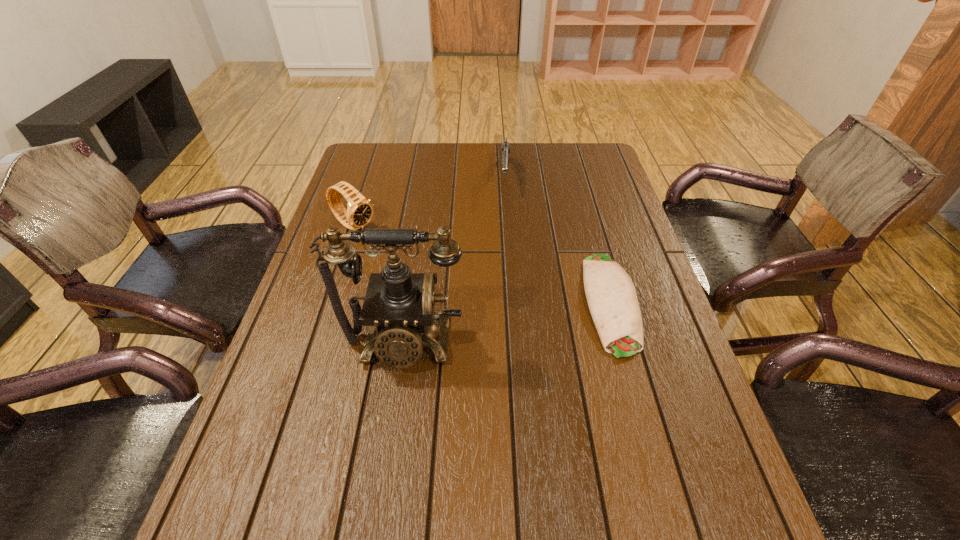
This screenshot has height=540, width=960. I want to click on free space located 0.220m on the face of the watch, so click(x=424, y=268).

You are a GUI agent. You are given a task and a screenshot of the screen. Output one action in this format:
    pyautogui.click(x=<x>, y=<y>)
    Task: Click on the vacant space located on the face of the watch
    The width and height of the screenshot is (960, 540).
    Given the screenshot: What is the action you would take?
    pyautogui.click(x=419, y=265)

Locate an element on the screen. The image size is (960, 540). vacant space located 0.230m aiming along the barrel of the second object from right to left is located at coordinates (505, 244).

Find the location of a particular element. The height and width of the screenshot is (540, 960). free region located aiming along the barrel of the second object from right to left is located at coordinates (503, 278).

Find the location of a particular element. The height and width of the screenshot is (540, 960). vacant space located 0.150m aiming along the barrel of the second object from right to left is located at coordinates (505, 226).

At what (x,y) coordinates should I click in order to perform the action: click on object present at the far edge. Please return your answer as a coordinate pair (x, y). The width and height of the screenshot is (960, 540). Looking at the image, I should click on (505, 151).

Where is `telephone located at the left edge`? Image resolution: width=960 pixels, height=540 pixels. telephone located at the left edge is located at coordinates (398, 306).

Find the location of a particular element. watch present at the left edge is located at coordinates [x=359, y=212].

The image size is (960, 540). I want to click on object at the right edge, so click(612, 299).

At what (x,y) coordinates should I click in order to perform the action: click on vacant space at the far edge of the desktop. Please return your answer as a coordinate pair (x, y). The height and width of the screenshot is (540, 960). Looking at the image, I should click on (406, 143).